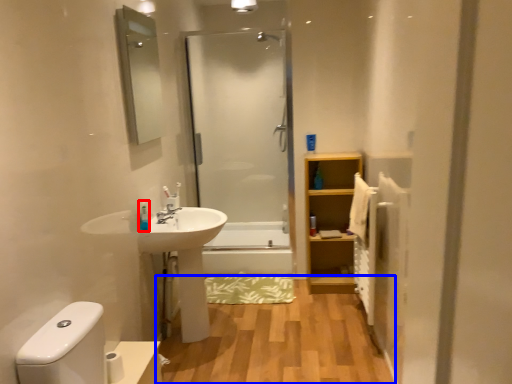
Question: Which point is further to the camera, toiletry (highlighted by a red box) or hardwood (highlighted by a blue box)?

Choices:
 (A) toiletry
 (B) hardwood

Answer: (A)